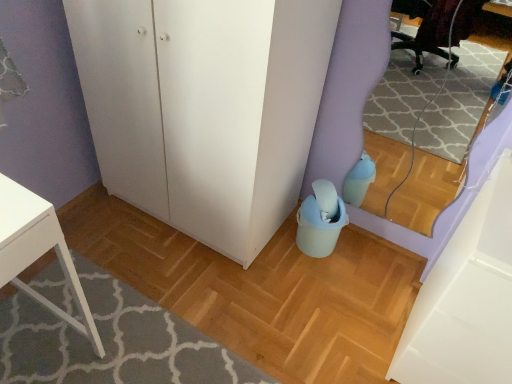
What are the coordinates of `free space in front of white matte cabinet at lower right` in the screenshot? It's located at [214, 291].